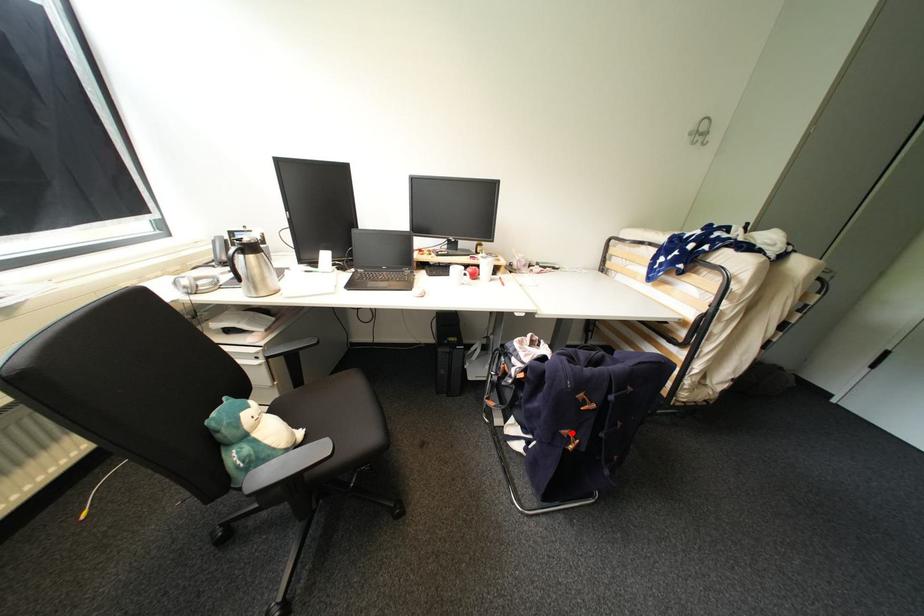
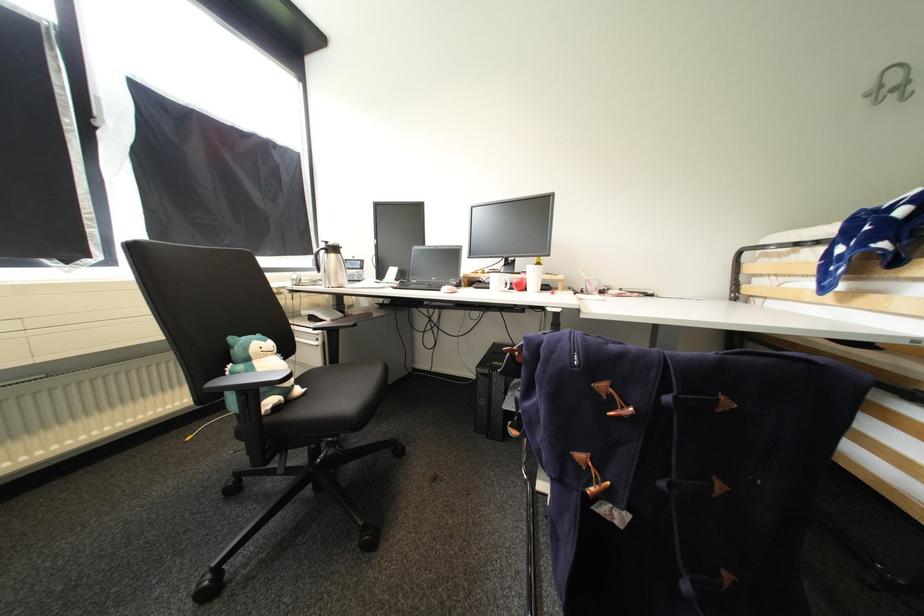
In the second image, find the point that corresponds to the highlighted location in the first image.

(588, 458)